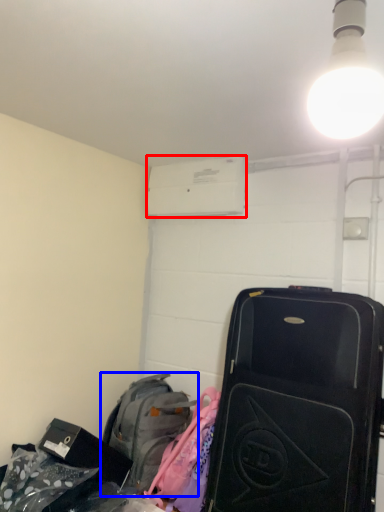
Question: Which object appears closest to the camera in this image, air conditioning (highlighted by a red box) or luggage and bags (highlighted by a blue box)?

Choices:
 (A) air conditioning
 (B) luggage and bags

Answer: (B)